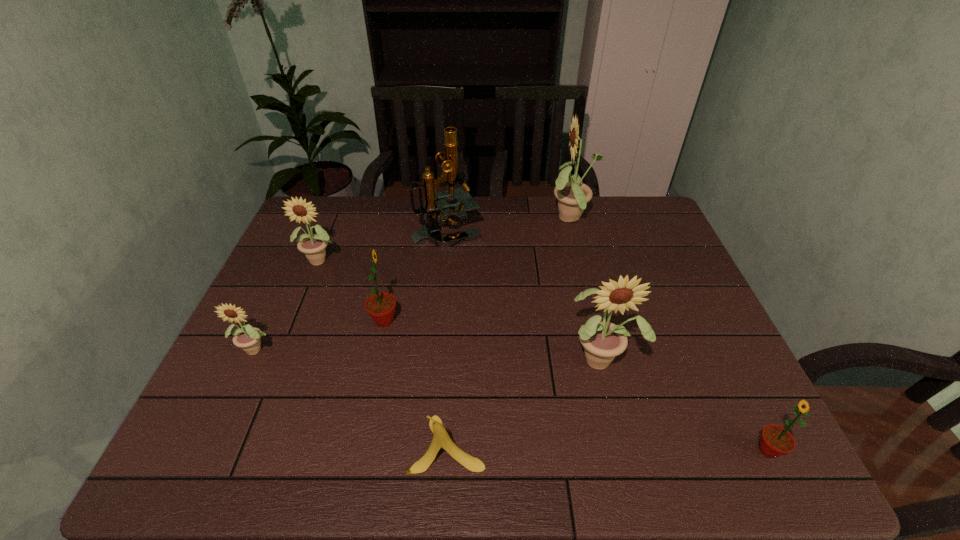
Find the location of `vacant space located on the front-facing side of the smallest yellow sunflower`. vacant space located on the front-facing side of the smallest yellow sunflower is located at coordinates (217, 437).

The width and height of the screenshot is (960, 540). I want to click on vacant space located on the face of the rightmost sunflower, so click(x=681, y=450).

Where is `vacant region located 0.050m on the face of the rightmost sunflower`? vacant region located 0.050m on the face of the rightmost sunflower is located at coordinates (729, 450).

You are a GUI agent. You are given a task and a screenshot of the screen. Output one action in this format:
    pyautogui.click(x=<x>, y=<y>)
    Task: Click on the blank area located 0.110m on the face of the rightmost sunflower
    Image resolution: width=960 pixels, height=540 pixels.
    Given the screenshot: What is the action you would take?
    pyautogui.click(x=700, y=450)

I want to click on vacant space located 0.300m on the left of the banana, so click(x=265, y=444).

Identify the location of sunflower at the far edge. (573, 196).

You are a GUI agent. You are given a task and a screenshot of the screen. Output one action in this format:
    pyautogui.click(x=<x>, y=<y>)
    Task: Click on the microscope situated at the far edge
    The image size is (960, 540).
    Given the screenshot: What is the action you would take?
    pyautogui.click(x=435, y=201)

This screenshot has height=540, width=960. I want to click on sunflower at the near edge, so click(x=775, y=441).

You are a GUI agent. You are given a task and a screenshot of the screen. Output one action in this format:
    pyautogui.click(x=<x>, y=<y>)
    Task: Click on the banana positioned at the near edge
    Image resolution: width=960 pixels, height=540 pixels.
    Given the screenshot: What is the action you would take?
    pyautogui.click(x=441, y=439)

Find the location of a particular element. This screenshot has height=540, width=960. object present at the right edge is located at coordinates (775, 441).